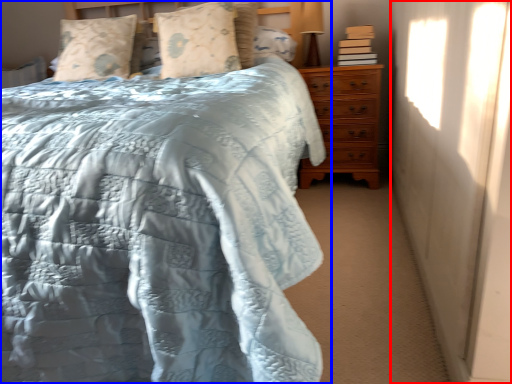
Question: Among these objects, which one is farthest to the camera, curtain (highlighted by a red box) or bed (highlighted by a blue box)?

Choices:
 (A) curtain
 (B) bed

Answer: (A)